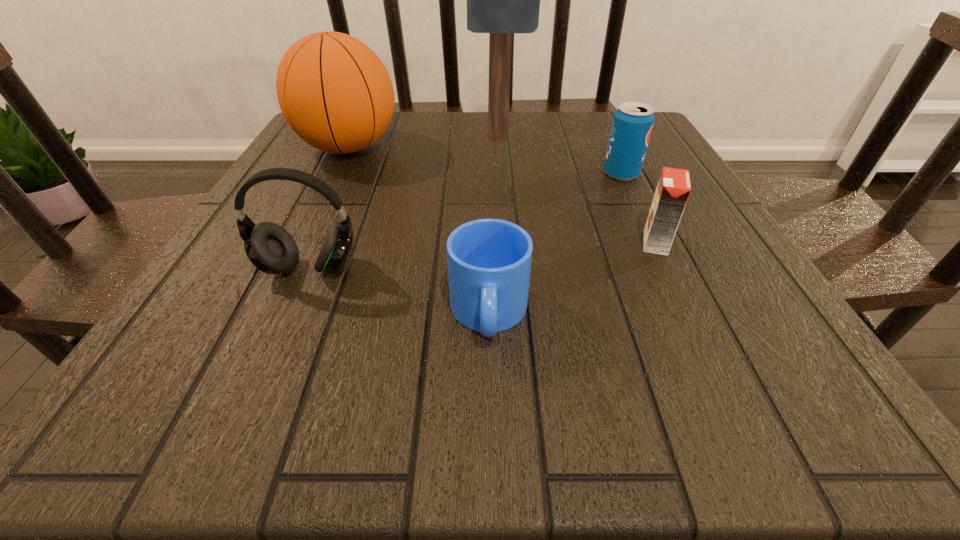
Locate an element on the screen. The image size is (960, 540). vacant area that lies between the orange juice and the basketball is located at coordinates (502, 195).

Locate which object is the third closest to the headset. Please provide its 2D coordinates. Your answer should be formatted as a tuple, i.e. [(x, y)], where the tuple contains the x and y coordinates of a point satisfying the conditions above.

[(501, 0)]

Choose which object is the nearest neighbor to the soda can. Please provide its 2D coordinates. Your answer should be formatted as a tuple, i.e. [(x, y)], where the tuple contains the x and y coordinates of a point satisfying the conditions above.

[(501, 0)]

At what (x,y) coordinates should I click in order to perform the action: click on vacant space that satisfies the following two spatial constraints: 1. on the front side of the tallest object; 2. on the right side of the orange juice. Please return your answer as a coordinate pair (x, y). The height and width of the screenshot is (540, 960). Looking at the image, I should click on (505, 243).

Locate an element on the screen. This screenshot has width=960, height=540. vacant area in the image that satisfies the following two spatial constraints: 1. on the front side of the soda can; 2. on the right side of the tallest object is located at coordinates (500, 174).